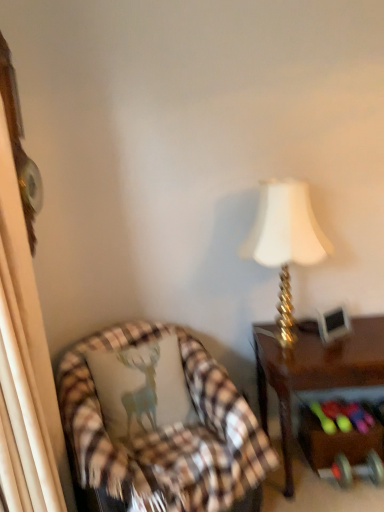
Question: From the image's perspective, is brown plaid chair at lower left under brown wooden desk at right?

Choices:
 (A) no
 (B) yes

Answer: (B)

Question: Can you confirm if brown plaid chair at lower left is shorter than brown wooden desk at right?

Choices:
 (A) no
 (B) yes

Answer: (A)

Question: From a real-world perspective, is brown plaid chair at lower left positioned over brown wooden desk at right based on gravity?

Choices:
 (A) yes
 (B) no

Answer: (A)

Question: Is brown plaid chair at lower left taller than brown wooden desk at right?

Choices:
 (A) no
 (B) yes

Answer: (B)

Question: Are brown plaid chair at lower left and brown wooden desk at right making contact?

Choices:
 (A) no
 (B) yes

Answer: (A)

Question: Is brown plaid chair at lower left aimed at brown wooden desk at right?

Choices:
 (A) no
 (B) yes

Answer: (A)

Question: Does gold metallic lamp at upper right have a smaller size compared to metallic silver dumbbell at lower right?

Choices:
 (A) no
 (B) yes

Answer: (A)

Question: Is gold metallic lamp at upper right at the left side of metallic silver dumbbell at lower right?

Choices:
 (A) yes
 (B) no

Answer: (A)

Question: From a real-world perspective, does gold metallic lamp at upper right sit lower than metallic silver dumbbell at lower right?

Choices:
 (A) yes
 (B) no

Answer: (B)

Question: Could you tell me if gold metallic lamp at upper right is turned towards metallic silver dumbbell at lower right?

Choices:
 (A) no
 (B) yes

Answer: (A)

Question: Is metallic silver dumbbell at lower right a part of gold metallic lamp at upper right?

Choices:
 (A) yes
 (B) no

Answer: (B)

Question: Is gold metallic lamp at upper right facing away from metallic silver dumbbell at lower right?

Choices:
 (A) yes
 (B) no

Answer: (B)

Question: From a real-world perspective, is brown wooden desk at right located higher than plaid fabric pillow at left?

Choices:
 (A) no
 (B) yes

Answer: (A)